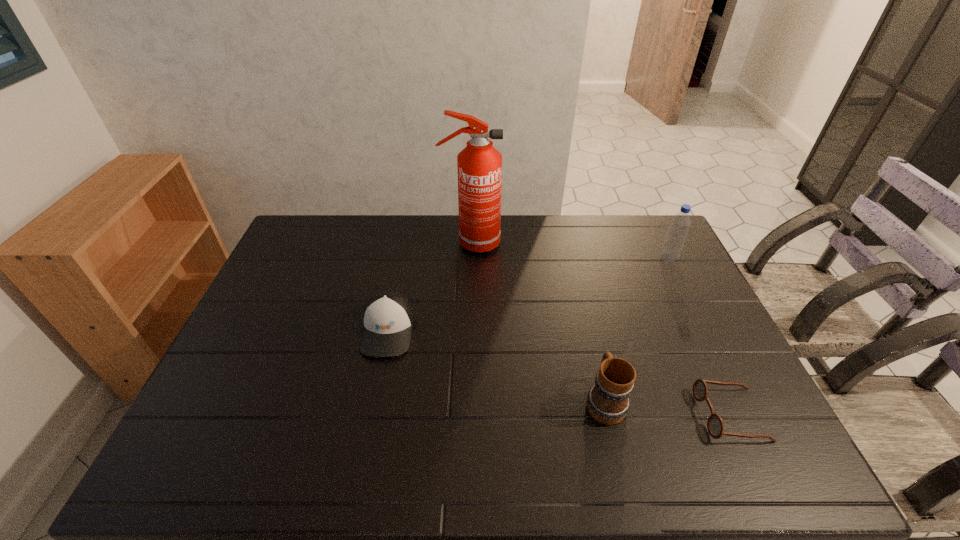
You are a GUI agent. You are given a task and a screenshot of the screen. Output one action in this format:
    pyautogui.click(x=<x>, y=<y>)
    Task: Click on the bottle present at the right edge
    This screenshot has height=540, width=960.
    Given the screenshot: What is the action you would take?
    pyautogui.click(x=674, y=240)

This screenshot has width=960, height=540. I want to click on spectacles that is at the right edge, so click(715, 425).

You are a GUI agent. You are given a task and a screenshot of the screen. Output one action in this format:
    pyautogui.click(x=<x>, y=<y>)
    Task: Click on the object that is positioned at the far right corner
    
    Given the screenshot: What is the action you would take?
    pyautogui.click(x=674, y=240)

Image resolution: width=960 pixels, height=540 pixels. I want to click on object at the near right corner, so click(715, 425).

In the image, there is a desktop. Where is `vacant space at the far edge`? The width and height of the screenshot is (960, 540). vacant space at the far edge is located at coordinates (609, 239).

I want to click on free space at the near edge of the desktop, so click(272, 446).

Image resolution: width=960 pixels, height=540 pixels. Find the location of `free space at the left edge of the desktop`. free space at the left edge of the desktop is located at coordinates (286, 272).

Identify the location of free spot at the far right corner of the desktop. [649, 245].

Locate an element on the screen. vacant space at the near right corner of the desktop is located at coordinates (744, 455).

You are a GUI agent. You are given a task and a screenshot of the screen. Output one action in this format:
    pyautogui.click(x=<x>, y=<y>)
    Task: Click on the empty location between the spectacles and the mug
    Image resolution: width=960 pixels, height=540 pixels.
    Given the screenshot: What is the action you would take?
    pyautogui.click(x=667, y=408)